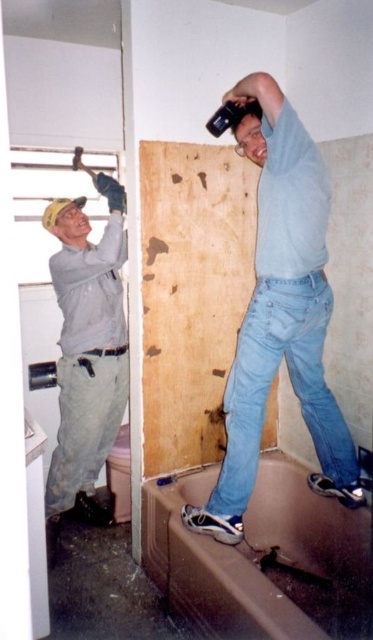
You are standing in the bathroom and see the light blue denim jeans at upper right and the matte gray shirt at upper left. Which one is higher up?

The light blue denim jeans at upper right is above the matte gray shirt at upper left, so it is higher up.